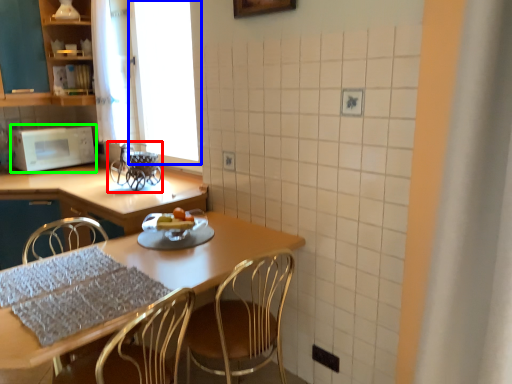
Question: Based on their relative distances, which object is farther from appliance (highlighted by a red box)? Choose from window screen (highlighted by a blue box) and microwave oven (highlighted by a green box).

Choices:
 (A) window screen
 (B) microwave oven

Answer: (A)